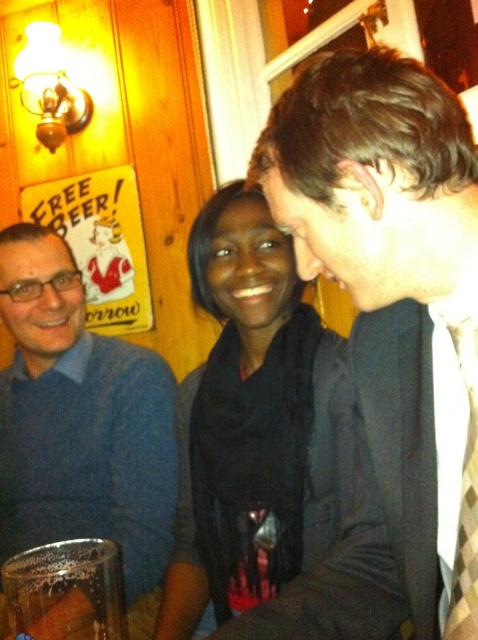
Question: Does black matte scarf at center have a smaller size compared to argyle-patterned tie at right?

Choices:
 (A) no
 (B) yes

Answer: (A)

Question: Which object appears closest to the camera in this image?

Choices:
 (A) argyle-patterned tie at right
 (B) blue sweater at left

Answer: (A)

Question: Which object is the closest to the black matte scarf at center?

Choices:
 (A) clear glass cup at lower left
 (B) argyle-patterned tie at right

Answer: (A)

Question: Is blue sweater at left thinner than clear glass cup at lower left?

Choices:
 (A) no
 (B) yes

Answer: (A)

Question: Is blue sweater at left smaller than clear glass cup at lower left?

Choices:
 (A) yes
 (B) no

Answer: (B)

Question: Which of the following is the closest to the observer?

Choices:
 (A) argyle-patterned tie at right
 (B) clear glass cup at lower left
 (C) black matte scarf at center

Answer: (A)